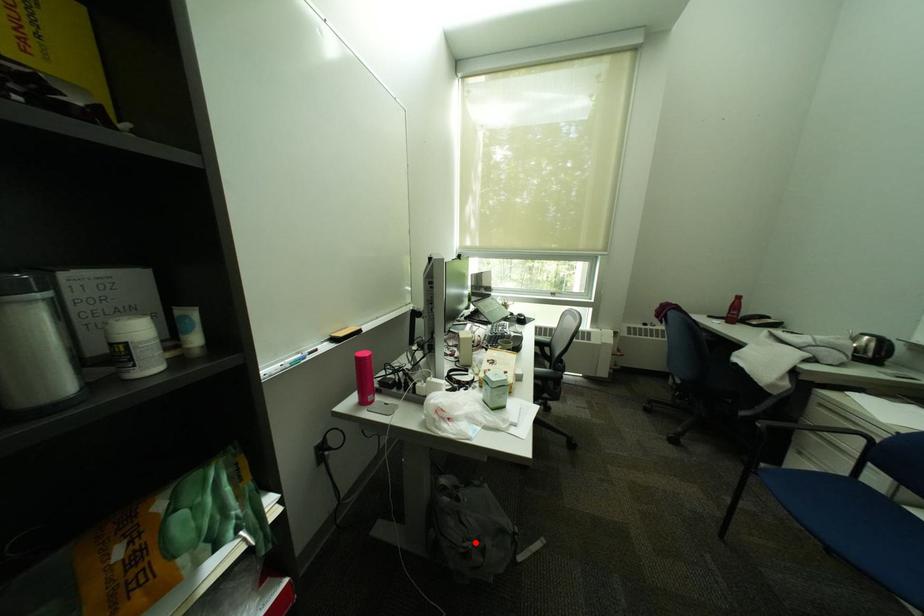
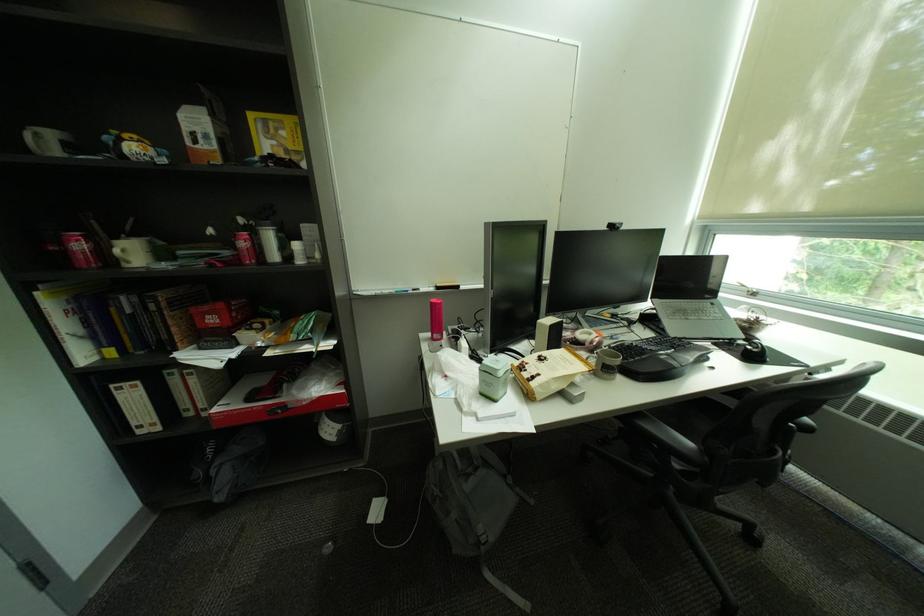
Question: I am providing you with two images of the same scene from different viewpoints. Image1 has a red point marked. In image2, the corresponding 3D location appears at what relative position? Reply with the corresponding letter.

Choices:
 (A) Closer
 (B) Farther

Answer: (B)